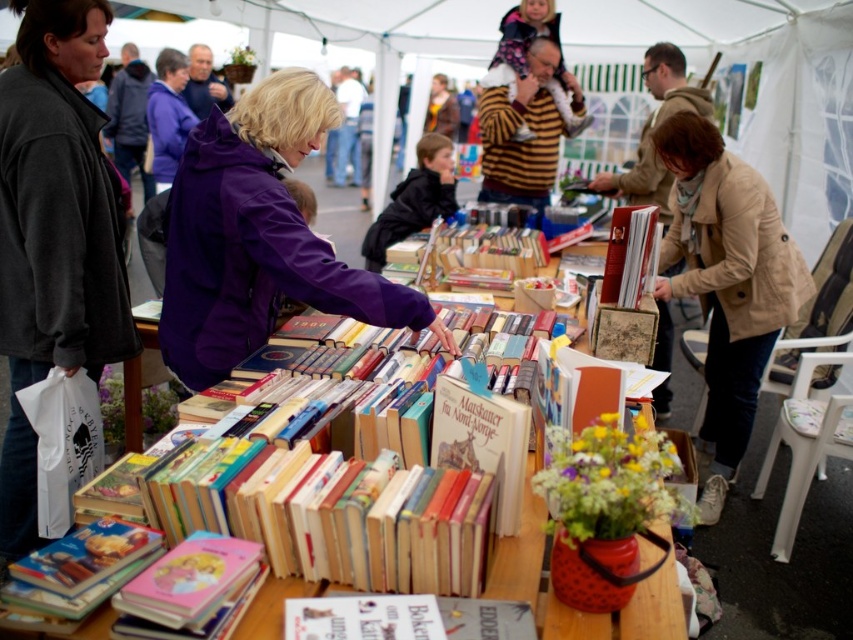
Question: Is beige coat at lower right thinner than hardcover book at center?

Choices:
 (A) yes
 (B) no

Answer: (B)

Question: In this image, where is beige coat at lower right located relative to pink matte book at lower left?

Choices:
 (A) above
 (B) below

Answer: (A)

Question: Which point appears farthest from the camera in this image?

Choices:
 (A) (650, 253)
 (B) (747, 227)

Answer: (B)

Question: Which object appears closest to the camera in this image?

Choices:
 (A) beige coat at lower right
 (B) pink matte book at lower left
 (C) hardcover book at center

Answer: (B)

Question: Can you confirm if beige coat at lower right is smaller than hardcover book at center?

Choices:
 (A) no
 (B) yes

Answer: (A)

Question: Which point appears farthest from the camera in this image?

Choices:
 (A) (140, 637)
 (B) (662, 280)
 (C) (630, 307)

Answer: (B)